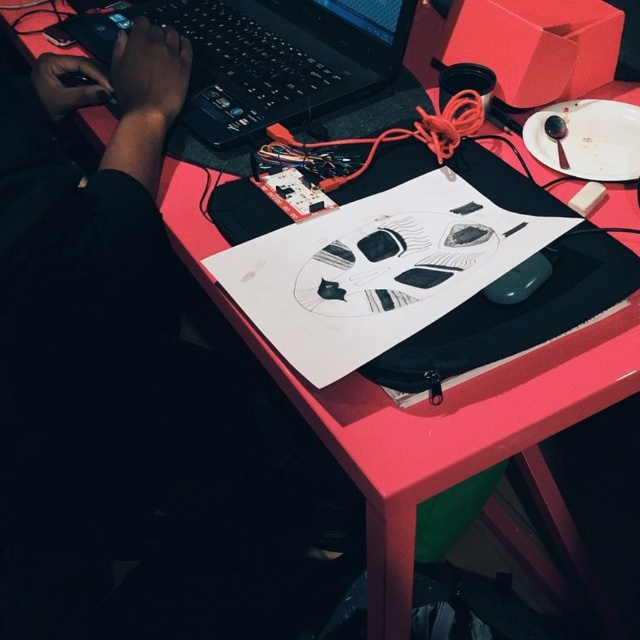
You need to place both the black plastic laptop at upper left and the black matte mouse at center into a storage box. The box can only hold items up to the size of the mouse. Will both items fit?

The black plastic laptop at upper left is larger in size than the black matte mouse at center, so it won let both items fit into the storage box since the laptop exceeds the size limit.

You are organizing the workspace on the vibrant pink table. You need to place a new item between the black plastic laptop at upper left and the black matte mouse at center. Is this possible given their positions?

The black plastic laptop at upper left is above the black matte mouse at center, so there is vertical space between them. You can place the new item between them vertically.

You are a delivery robot in the workspace. You need to move from the point at [388,38] to the laptop. The minimum turning radius of your robot is 20 inches. Can you navigate to the laptop without colliding with any objects?

The distance between the point at [388,38] and the laptop is 30.90 inches. Since the minimum turning radius of the robot is 20 inches, the robot can navigate to the laptop as the distance allows for a path with a turning radius of at least 20 inches.